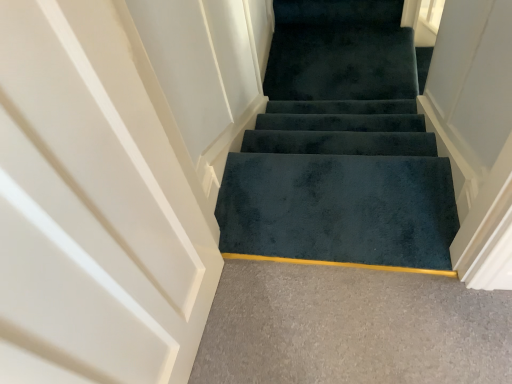
Question: In terms of height, does dark blue carpet at center look taller or shorter compared to dark green carpet at center?

Choices:
 (A) tall
 (B) short

Answer: (B)

Question: Is dark blue carpet at center wider or thinner than dark green carpet at center?

Choices:
 (A) thin
 (B) wide

Answer: (B)

Question: Based on their relative distances, which object is nearer to the dark green carpet at center?

Choices:
 (A) dark blue carpet at center
 (B) dark blue carpet at center

Answer: (A)

Question: Estimate the real-world distances between objects in this image. Which object is closer to the dark blue carpet at center?

Choices:
 (A) dark blue carpet at center
 (B) dark green carpet at center

Answer: (A)